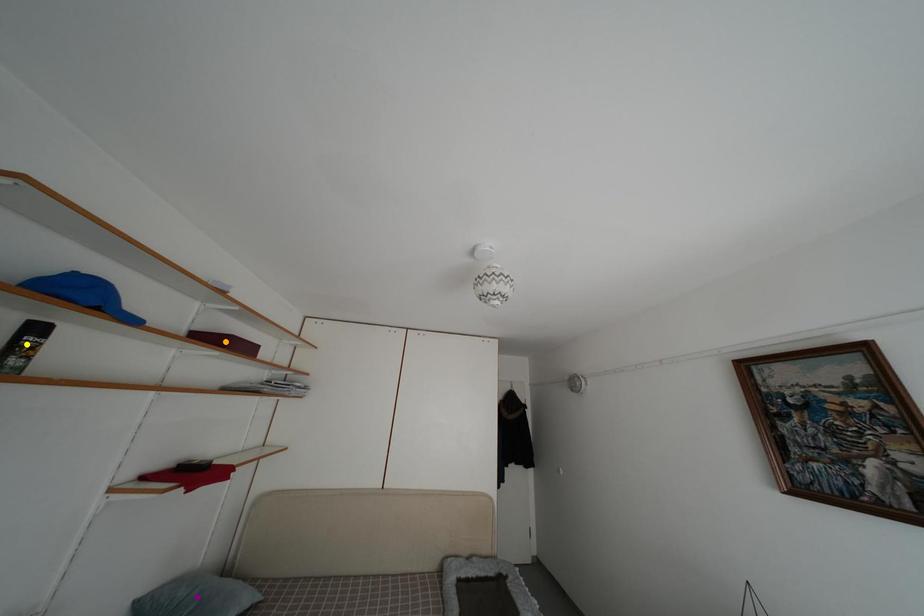
Order these from nearest to farthest:
A) orange point
B) yellow point
C) purple point

yellow point, purple point, orange point